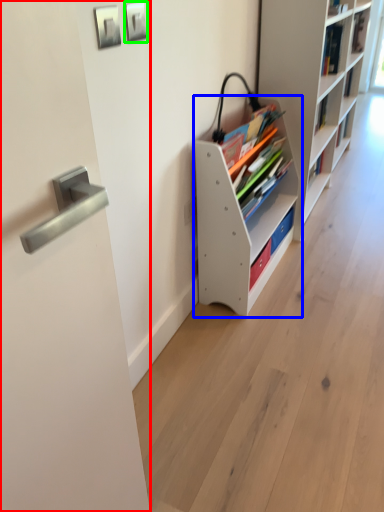
Question: Which is farther away from door (highlighted by a red box)? shelf (highlighted by a blue box) or picture frame (highlighted by a green box)?

Choices:
 (A) shelf
 (B) picture frame

Answer: (A)